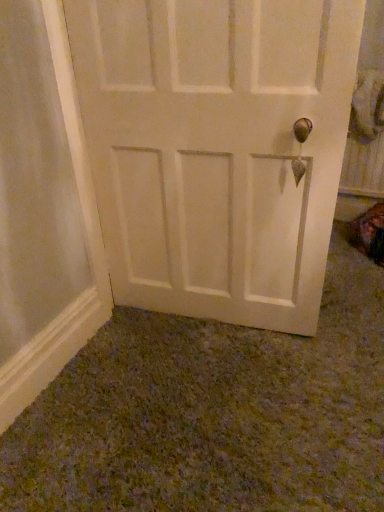
The height and width of the screenshot is (512, 384). What are the coordinates of `vacant area that is situated to the right of white matte door at center` in the screenshot? It's located at (332, 328).